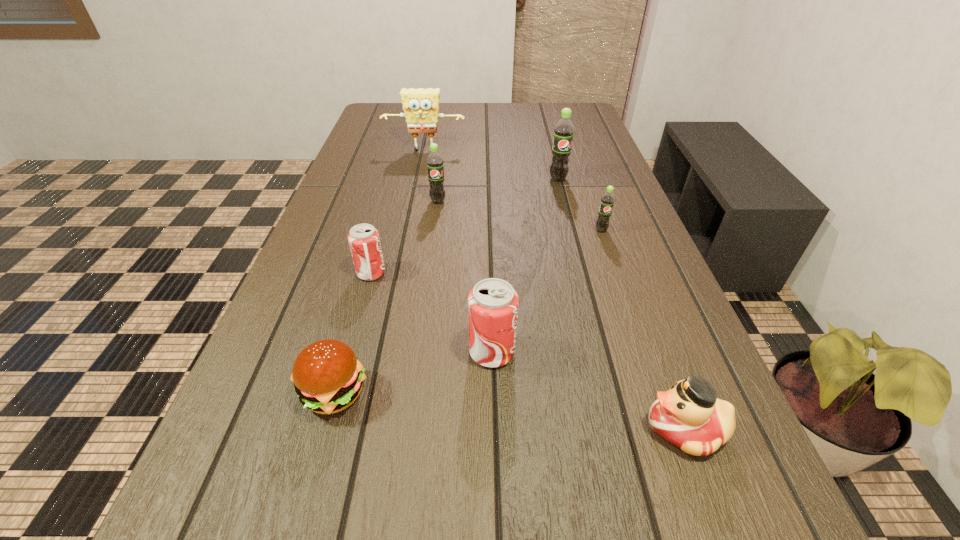
This screenshot has width=960, height=540. What are the coordinates of `the third object from right to left` in the screenshot? It's located at (563, 131).

You are a GUI agent. You are given a task and a screenshot of the screen. Output one action in this format:
    pyautogui.click(x=<x>, y=<y>)
    Task: Click on the tallest soda
    
    Given the screenshot: What is the action you would take?
    pyautogui.click(x=563, y=131)

This screenshot has width=960, height=540. I want to click on the farthest object, so click(421, 106).

Locate an element on the screen. The width and height of the screenshot is (960, 540). sponge is located at coordinates (421, 106).

Locate an element on the screen. the second biggest green soda is located at coordinates (435, 167).

The image size is (960, 540). I want to click on the third farthest object, so click(x=435, y=167).

At what (x,y) coordinates should I click in order to perform the action: click on the nearer pink soda can. Please return your answer as a coordinate pair (x, y). Looking at the image, I should click on (493, 303).

Where is `the nearest soda`? Image resolution: width=960 pixels, height=540 pixels. the nearest soda is located at coordinates (493, 303).

This screenshot has height=540, width=960. In order to click on the leftmost soda in this screenshot , I will do `click(364, 242)`.

Locate an element on the screen. The width and height of the screenshot is (960, 540). the left pink soda can is located at coordinates (364, 242).